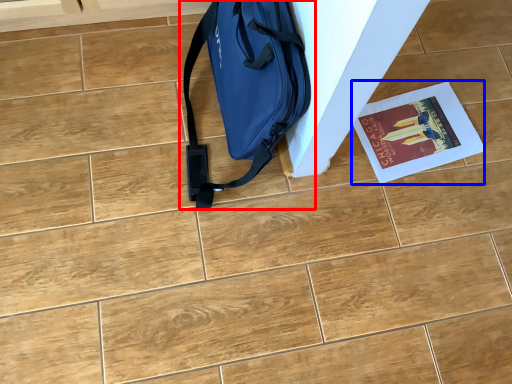
Question: Among these objects, which one is farthest to the camera, luggage and bags (highlighted by a red box) or magazine (highlighted by a blue box)?

Choices:
 (A) luggage and bags
 (B) magazine

Answer: (B)